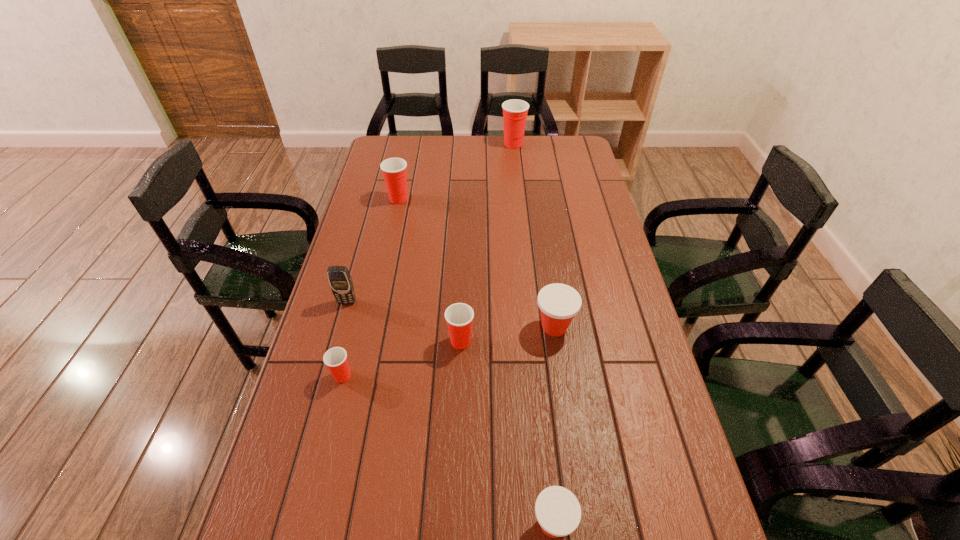
At what (x,y) coordinates should I click in order to perform the action: click on vacant space located 0.190m on the left of the farthest object. Please return your answer as a coordinate pair (x, y). The width and height of the screenshot is (960, 540). Looking at the image, I should click on (458, 144).

Find the location of a particular element. vacant space situated on the back of the second farthest object is located at coordinates (402, 183).

Identify the location of free space located on the front face of the cellular telephone. (338, 335).

Identify the location of free point located 0.370m on the left of the second nearest red Dixie cup. (314, 341).

You are a GUI agent. You are given a task and a screenshot of the screen. Output one action in this format:
    pyautogui.click(x=<x>, y=<y>)
    Task: Click on the free region located on the left of the farther red-orange Dixie cup
    
    Given the screenshot: What is the action you would take?
    pyautogui.click(x=404, y=327)

In order to click on free space located 0.380m on the back of the fifth farthest Dixie cup in this screenshot , I will do `click(370, 266)`.

The width and height of the screenshot is (960, 540). What are the coordinates of `object that is at the far edge` in the screenshot? It's located at (515, 111).

You are a GUI agent. You are given a task and a screenshot of the screen. Output one action in this format:
    pyautogui.click(x=<x>, y=<y>)
    Task: Click on the cellular telephone that is at the left edge
    Image resolution: width=960 pixels, height=540 pixels.
    Given the screenshot: What is the action you would take?
    pyautogui.click(x=340, y=280)

Where is `free space at the far edge of the desktop`? free space at the far edge of the desktop is located at coordinates (420, 164).

In order to click on vacant space at the left edge of the desktop in this screenshot , I will do point(278,475).